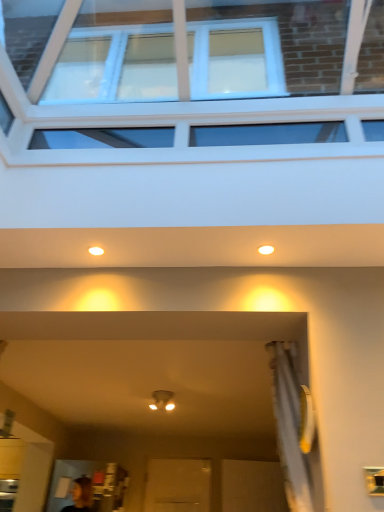
Question: From a real-world perspective, is matte white light fixture at center over matte white light fixture at upper center, which is the second lighting from left to right?

Choices:
 (A) no
 (B) yes

Answer: (A)

Question: Is matte white light fixture at center with matte white light fixture at upper center, the 1th lighting positioned from the right?

Choices:
 (A) yes
 (B) no

Answer: (B)

Question: Considering the relative sizes of matte white light fixture at center and matte white light fixture at upper center, which is the second lighting from left to right, in the image provided, is matte white light fixture at center thinner than matte white light fixture at upper center, which is the second lighting from left to right,?

Choices:
 (A) yes
 (B) no

Answer: (B)

Question: Is matte white light fixture at center completely or partially outside of matte white light fixture at upper center, the 1th lighting positioned from the right?

Choices:
 (A) no
 (B) yes

Answer: (B)

Question: Is matte white light fixture at center behind matte white light fixture at upper center, which is the second lighting from left to right?

Choices:
 (A) yes
 (B) no

Answer: (A)

Question: Considering the relative sizes of matte white light fixture at center and matte white light fixture at upper center, the 1th lighting positioned from the right, in the image provided, is matte white light fixture at center taller than matte white light fixture at upper center, the 1th lighting positioned from the right,?

Choices:
 (A) no
 (B) yes

Answer: (B)

Question: Considering the relative sizes of matte white light fixture at upper center, marked as the first lighting in a left-to-right arrangement, and clear glass window at upper center in the image provided, is matte white light fixture at upper center, marked as the first lighting in a left-to-right arrangement, thinner than clear glass window at upper center?

Choices:
 (A) no
 (B) yes

Answer: (B)

Question: From the image's perspective, is matte white light fixture at upper center, marked as the first lighting in a left-to-right arrangement, located above clear glass window at upper center?

Choices:
 (A) yes
 (B) no

Answer: (B)

Question: Considering the relative sizes of matte white light fixture at upper center, which is the 2th lighting from right to left, and clear glass window at upper center in the image provided, is matte white light fixture at upper center, which is the 2th lighting from right to left, shorter than clear glass window at upper center?

Choices:
 (A) yes
 (B) no

Answer: (A)

Question: Is matte white light fixture at upper center, marked as the first lighting in a left-to-right arrangement, positioned behind clear glass window at upper center?

Choices:
 (A) no
 (B) yes

Answer: (B)

Question: From a real-world perspective, is matte white light fixture at upper center, marked as the first lighting in a left-to-right arrangement, physically below clear glass window at upper center?

Choices:
 (A) no
 (B) yes

Answer: (B)

Question: Is matte white light fixture at upper center, which is the 2th lighting from right to left, oriented towards clear glass window at upper center?

Choices:
 (A) yes
 (B) no

Answer: (A)

Question: From a real-world perspective, does matte white light fixture at upper center, which is the second lighting from left to right, stand above matte white light fixture at upper center, which is the 2th lighting from right to left?

Choices:
 (A) yes
 (B) no

Answer: (B)